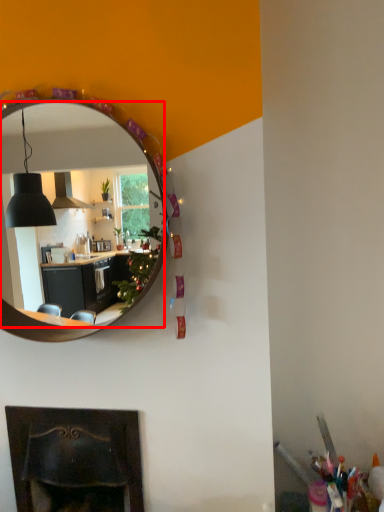
Question: From the image's perspective, considering the relative positions of mirror (annotated by the red box) and fireplace in the image provided, where is mirror (annotated by the red box) located with respect to the staircase?

Choices:
 (A) above
 (B) below

Answer: (A)